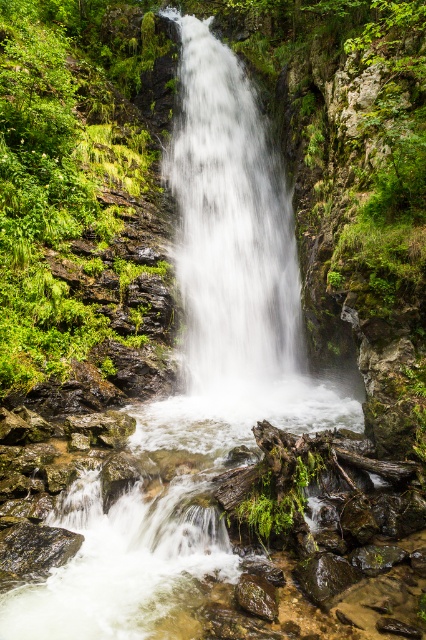
Question: Can you confirm if white frothy water at center is positioned above smooth brown rock at lower center?

Choices:
 (A) yes
 (B) no

Answer: (A)

Question: Is white frothy water at center further to camera compared to smooth brown rock at lower center?

Choices:
 (A) yes
 (B) no

Answer: (A)

Question: Which point is farther to the camera?

Choices:
 (A) smooth brown rock at lower center
 (B) white frothy water at center

Answer: (B)

Question: Where is white frothy water at center located in relation to smooth brown rock at lower center in the image?

Choices:
 (A) left
 (B) right

Answer: (A)

Question: Which object is closer to the camera taking this photo?

Choices:
 (A) smooth brown rock at lower center
 (B) white frothy water at center

Answer: (A)

Question: Among these points, which one is farthest from the camera?

Choices:
 (A) (247, 577)
 (B) (235, 262)

Answer: (B)